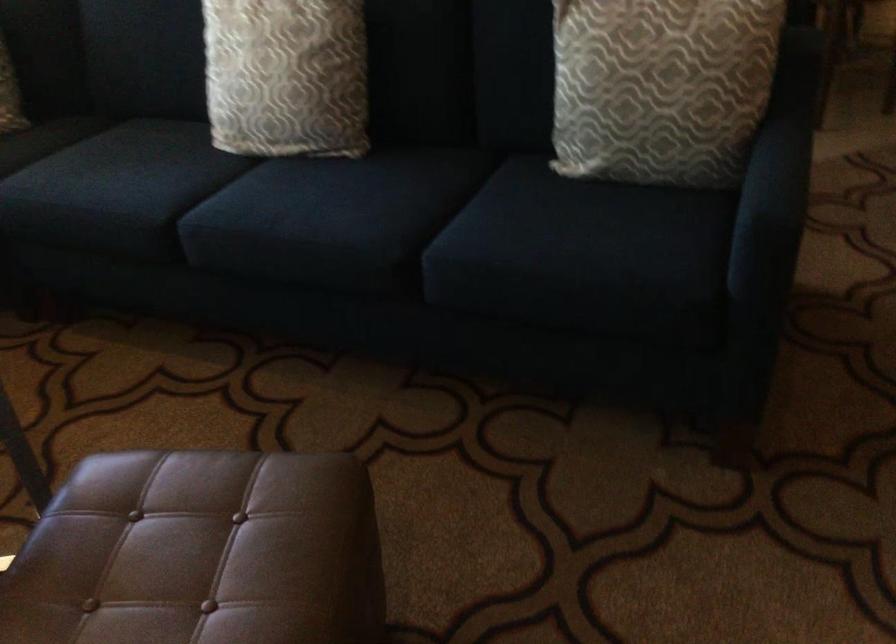
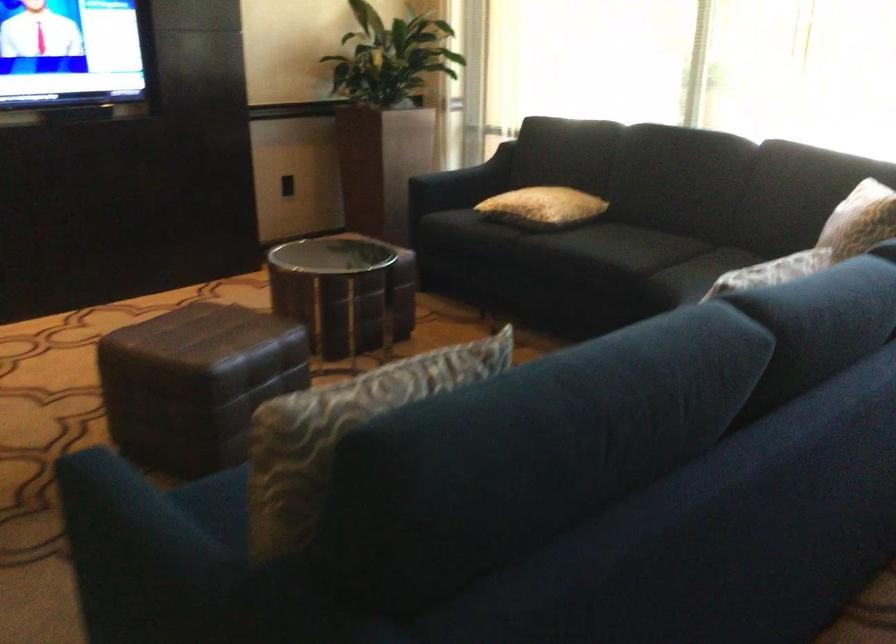
Find the pixel in the second image that matches the point at 770,162 in the first image.

(134, 534)